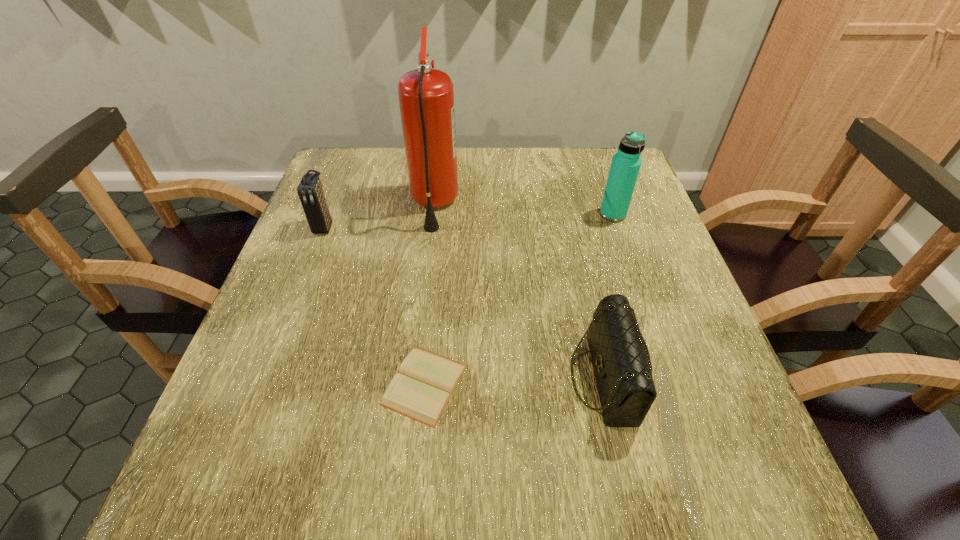
This screenshot has width=960, height=540. Find the location of `free space that satisfies the following two spatial constraints: 1. on the back side of the water bottle; 2. on the right side of the shortest object`. free space that satisfies the following two spatial constraints: 1. on the back side of the water bottle; 2. on the right side of the shortest object is located at coordinates (442, 214).

Locate an element on the screen. free space that satisfies the following two spatial constraints: 1. with the zip open on the shortest object; 2. on the left side of the taller clutch bag is located at coordinates (263, 384).

Identify the location of vacant space that satisfies the following two spatial constraints: 1. with the zip open on the shortest object; 2. on the left side of the taller clutch bag. (263, 384).

Find the location of a particular element. The width and height of the screenshot is (960, 540). vacant region that satisfies the following two spatial constraints: 1. on the instruction side of the diary; 2. on the left side of the fire extinguisher is located at coordinates (413, 384).